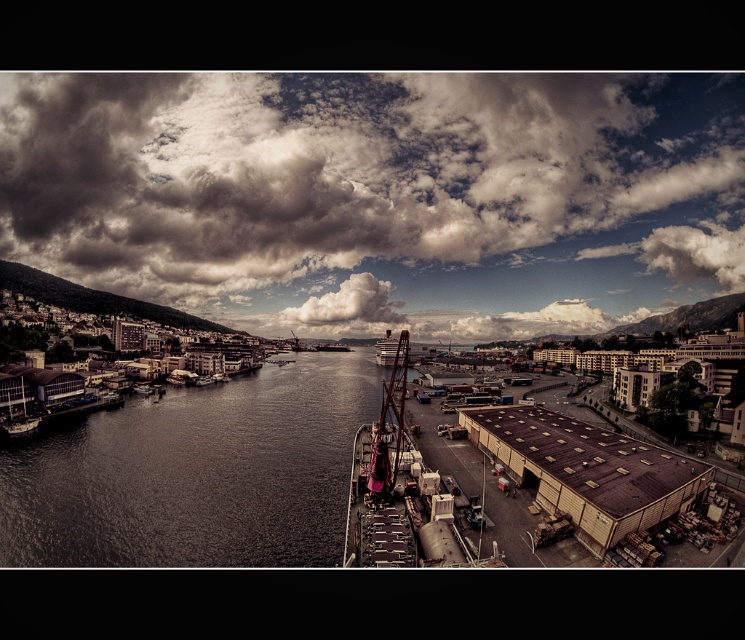
Is dark brown water at center positioned before white fluffy cloud at upper center?

Yes, dark brown water at center is closer to the viewer.

The image size is (745, 640). Identify the location of dark brown water at center. (196, 474).

In order to click on dark brown water at center in this screenshot , I will do `click(196, 474)`.

Does brown corrugated metal dock at lower right have a smaller size compared to metallic gray crane at center?

Indeed, brown corrugated metal dock at lower right has a smaller size compared to metallic gray crane at center.

Is point (609, 456) positioned before point (387, 428)?

Yes, point (609, 456) is closer to viewer.

Where is `brown corrugated metal dock at lower right`? The image size is (745, 640). brown corrugated metal dock at lower right is located at coordinates (586, 470).

Who is taller, cloudy sky at upper center or brown corrugated metal dock at lower right?

Standing taller between the two is cloudy sky at upper center.

Based on the photo, is cloudy sky at upper center taller than brown corrugated metal dock at lower right?

Yes, cloudy sky at upper center is taller than brown corrugated metal dock at lower right.

Which is behind, point (145, 292) or point (618, 531)?

The point (145, 292) is more distant.

I want to click on cloudy sky at upper center, so click(x=381, y=192).